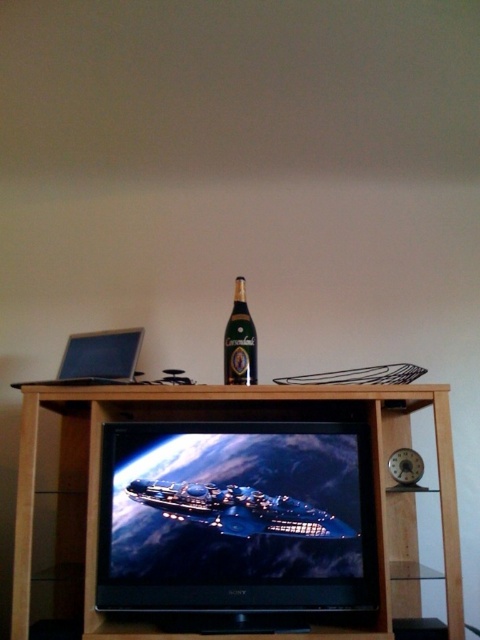
Question: Observing the image, what is the correct spatial positioning of black glossy flat screen tv at center in reference to black wood entertainment center at center?

Choices:
 (A) left
 (B) right

Answer: (B)

Question: Which object is positioned farthest from the black wood entertainment center at center?

Choices:
 (A) black glossy flat screen tv at center
 (B) green glass bottle at center

Answer: (B)

Question: Is matte black laptop at left positioned at the back of green glass bottle at center?

Choices:
 (A) no
 (B) yes

Answer: (A)

Question: Which point is closer to the camera?

Choices:
 (A) green glass bottle at center
 (B) black wood entertainment center at center
 (C) matte black laptop at left
 (D) black glossy flat screen tv at center

Answer: (B)

Question: Which object is positioned farthest from the black wood entertainment center at center?

Choices:
 (A) green glass bottle at center
 (B) black glossy flat screen tv at center
 (C) matte black laptop at left

Answer: (A)

Question: Is black wood entertainment center at center wider than matte black laptop at left?

Choices:
 (A) yes
 (B) no

Answer: (A)